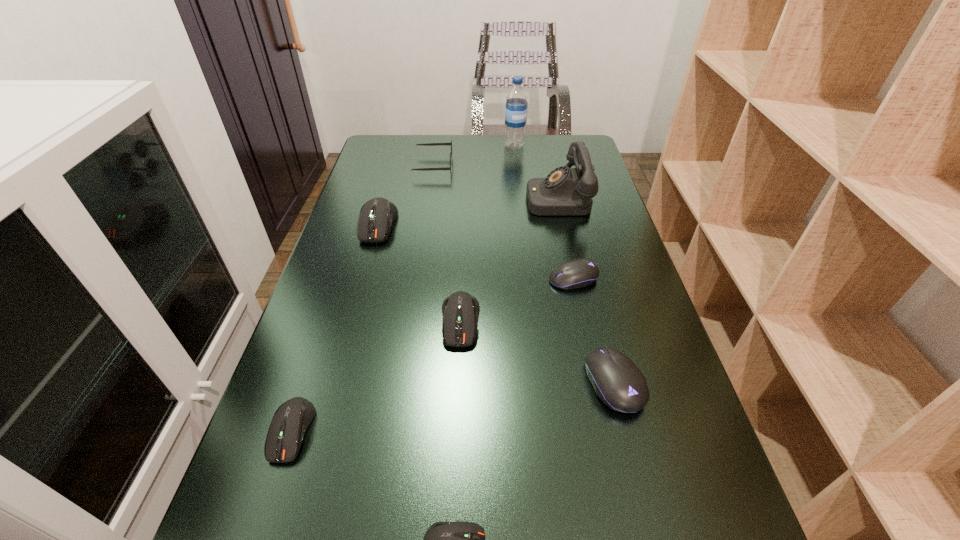
What are the coordinates of `the fifth closest object to the smallest dark computer equipment` in the screenshot? It's located at (376, 216).

Select which object appears as the second closest to the farthest object. Please provide its 2D coordinates. Your answer should be formatted as a tuple, i.e. [(x, y)], where the tuple contains the x and y coordinates of a point satisfying the conditions above.

[(427, 144)]

Identify which computer equipment is located as the second nearest to the tallest computer equipment. Please provide its 2D coordinates. Your answer should be formatted as a tuple, i.e. [(x, y)], where the tuple contains the x and y coordinates of a point satisfying the conditions above.

[(578, 273)]

The height and width of the screenshot is (540, 960). I want to click on computer equipment that stands as the second closest to the second smallest dark computer equipment, so click(460, 310).

Choose which dark computer equipment is the nearest neighbor to the second tallest object. Please provide its 2D coordinates. Your answer should be formatted as a tuple, i.e. [(x, y)], where the tuple contains the x and y coordinates of a point satisfying the conditions above.

[(460, 310)]

At what (x,y) coordinates should I click in order to perform the action: click on dark computer equipment that is the third nearest to the second smallest dark computer equipment. Please return your answer as a coordinate pair (x, y). The image size is (960, 540). Looking at the image, I should click on pyautogui.click(x=376, y=216).

This screenshot has height=540, width=960. I want to click on black computer mouse that is the closest to the second smallest dark computer equipment, so click(x=617, y=381).

Locate which black computer mouse is the closest to the tallest object. Please provide its 2D coordinates. Your answer should be formatted as a tuple, i.e. [(x, y)], where the tuple contains the x and y coordinates of a point satisfying the conditions above.

[(578, 273)]

You are a GUI agent. You are given a task and a screenshot of the screen. Output one action in this format:
    pyautogui.click(x=<x>, y=<y>)
    Task: Click on the vacant area in the image that satisfies the following two spatial constraints: 1. on the dial of the gray telephone; 2. on the button of the second smallest dark computer equipment
    The height and width of the screenshot is (540, 960).
    Given the screenshot: What is the action you would take?
    pyautogui.click(x=611, y=431)

Locate an element on the screen. free space that satisfies the following two spatial constraints: 1. on the front-facing side of the third object from left to right; 2. on the left side of the fifth nearest computer equipment is located at coordinates (416, 279).